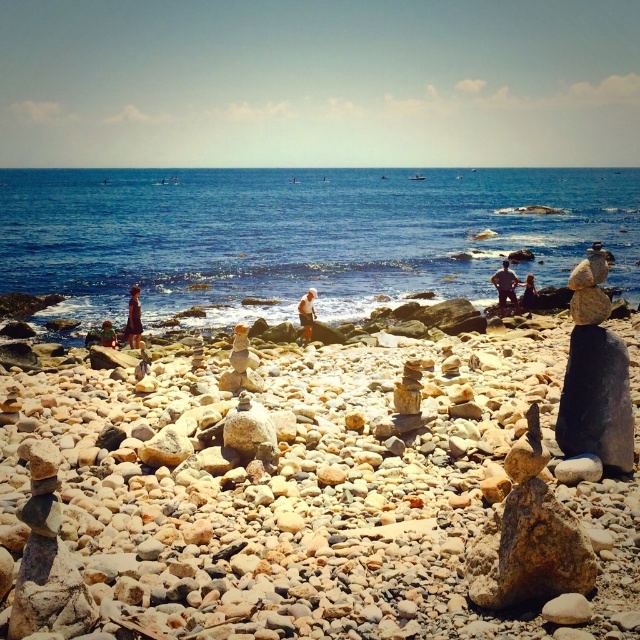
Based on the scene description, where is the smooth sand at center located in the image?

The smooth sand at center is located at point coordinates of (x=241, y=349).

You are standing on the beach and want to reach the point marked as point (132,330). If your walking speed is 3 feet per second, how many seconds will it take you to reach that point?

The point (132,330) is 85.61 feet away from the viewer. At a walking speed of 3 feet per second, it would take approximately 28.5 seconds to reach the point.